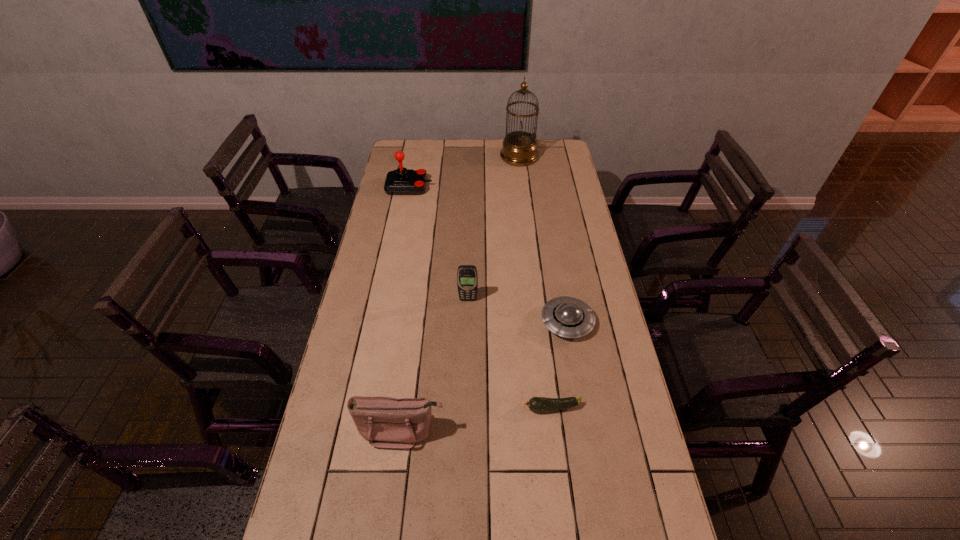
Image resolution: width=960 pixels, height=540 pixels. Find the location of `birdcage`. birdcage is located at coordinates (519, 148).

Find the location of `the tallest object`. the tallest object is located at coordinates (519, 148).

The image size is (960, 540). I want to click on the fifth nearest object, so click(x=402, y=181).

Locate an element on the screen. This screenshot has height=540, width=960. the fourth nearest object is located at coordinates (467, 277).

Find the location of `cellular telephone`. cellular telephone is located at coordinates (467, 277).

Locate an element on the screen. shoulder bag is located at coordinates pyautogui.click(x=386, y=422).

I want to click on the fifth tallest object, so click(569, 317).

Identify the location of saucer. The image size is (960, 540). (569, 317).

Image resolution: width=960 pixels, height=540 pixels. Identify the location of the shortest object. (536, 404).

I want to click on vacant position located with an open door on the tallest object, so click(x=456, y=157).